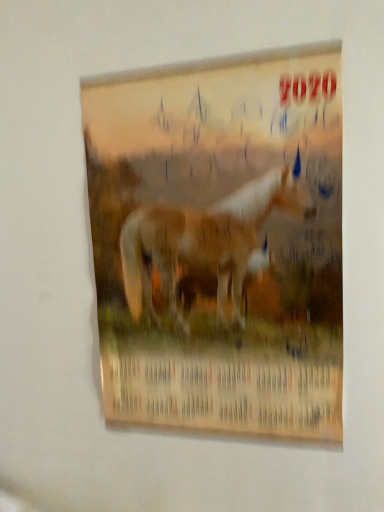
Question: Should I look upward or downward to see matte paper poster at center?

Choices:
 (A) up
 (B) down

Answer: (B)